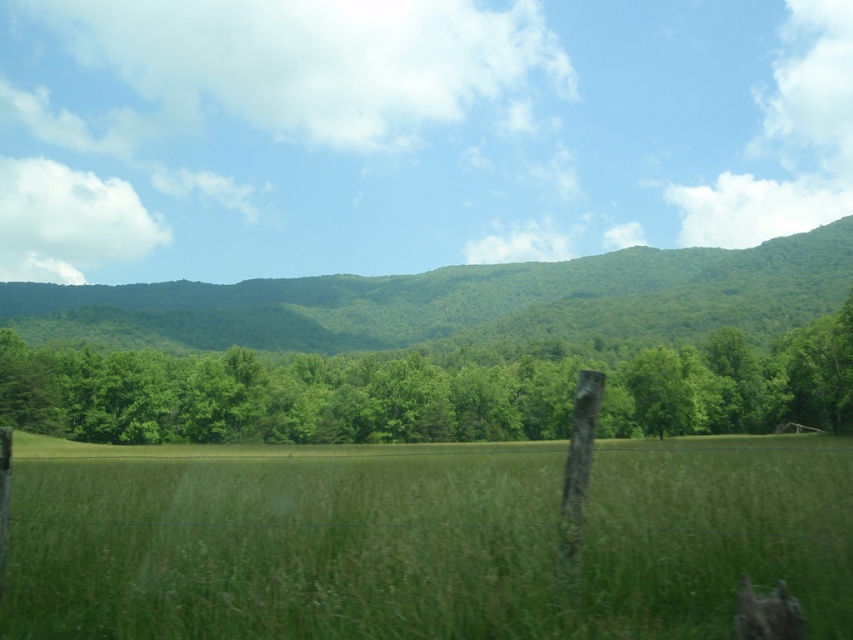
Question: Which object is the farthest from the green leafy forest at center?

Choices:
 (A) green leafy tree at center
 (B) green grassy field at center

Answer: (B)

Question: Is green grassy field at center positioned in front of green leafy forest at center?

Choices:
 (A) yes
 (B) no

Answer: (A)

Question: Which object is positioned closest to the green grassy field at center?

Choices:
 (A) green leafy tree at center
 (B) green leafy forest at center

Answer: (A)

Question: Is green grassy field at center below green leafy tree at center?

Choices:
 (A) no
 (B) yes

Answer: (A)

Question: Can you confirm if green leafy tree at center is positioned to the left of green leafy forest at center?

Choices:
 (A) no
 (B) yes

Answer: (B)

Question: Which object is closer to the camera taking this photo?

Choices:
 (A) green grassy field at center
 (B) green leafy forest at center
 (C) green leafy tree at center

Answer: (A)